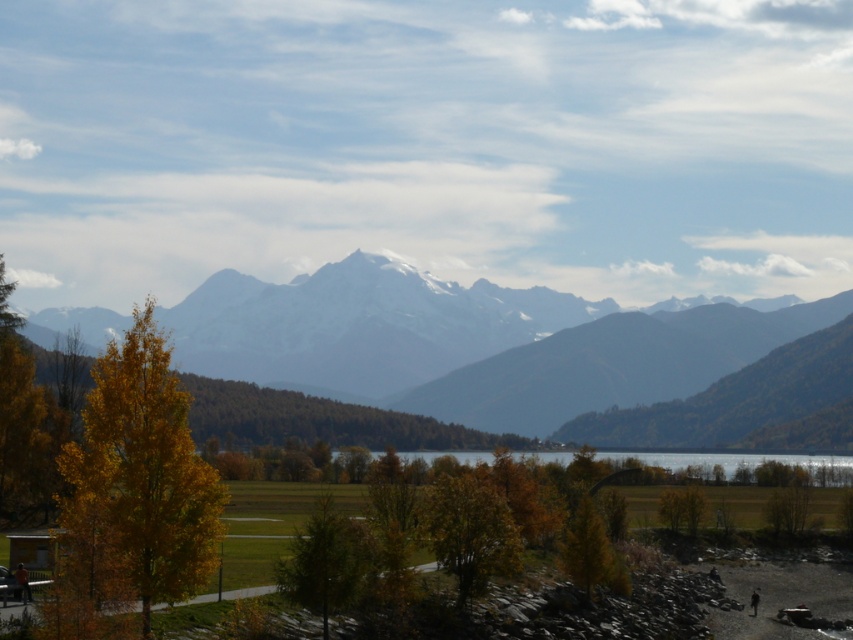
From the picture: You are standing at the starting point of the pathway in the grassy field and want to walk towards the central snowy mountain peak. Which point, point (786, 320) or point (751, 458), is closer to your current position?

Point (786, 320) is further to the camera than point (751, 458). Since you are at the starting point of the pathway, the closer point to your current position would be point (751, 458) as it is nearer to the camera compared to the other point.

You are standing at the start of the pathway and want to walk towards the clear glass lake at center. Which direction should you turn to avoid the green matte tree at center?

The green matte tree at center is on the left side of the clear glass lake at center, so to avoid it, you should turn to the right side of the clear glass lake at center.